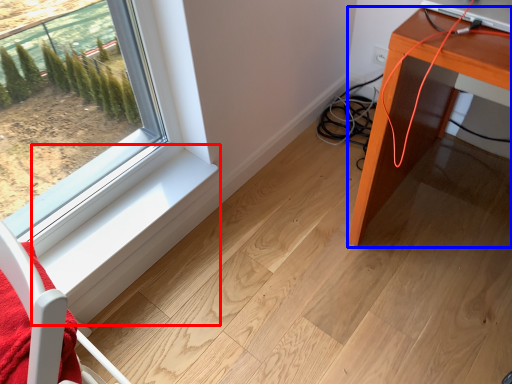
Question: Which object is closer to the camera taking this photo, window sill (highlighted by a red box) or table (highlighted by a blue box)?

Choices:
 (A) window sill
 (B) table

Answer: (B)